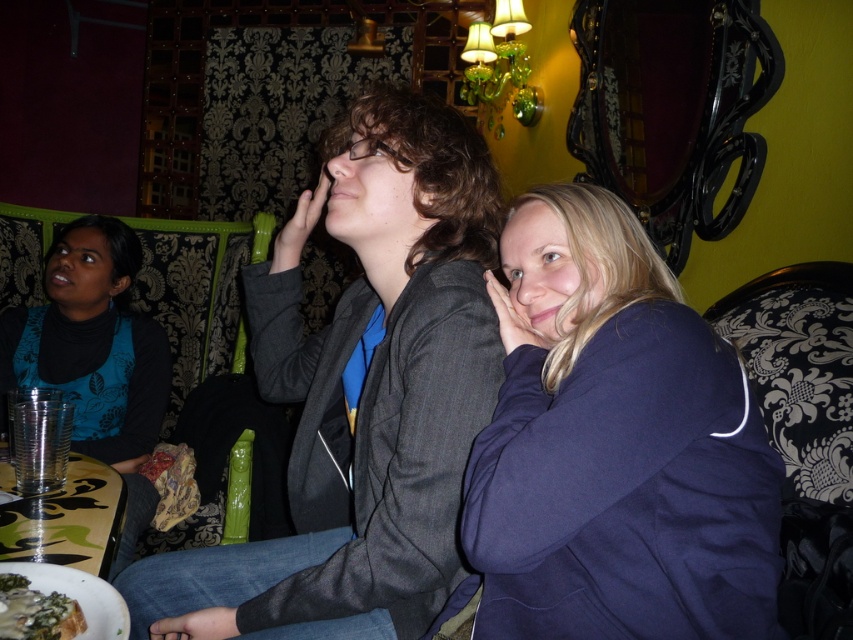
You are an interior designer analyzing the placement of clothing items in the scene. Given that the coordinate system starts at the bottom left corner of the image with x and y axes, can you determine if the matte gray blazer at center is positioned closer to the right edge of the image compared to the center point?

The matte gray blazer at center is located at coordinates point [361,392]. Since the coordinate system starts at the bottom left corner, the center point of the image would be at approximately [426,320]. Comparing the x coordinate of 0.614 to 0.5, the matte gray blazer at center is positioned closer to the right edge of the image than the center point.